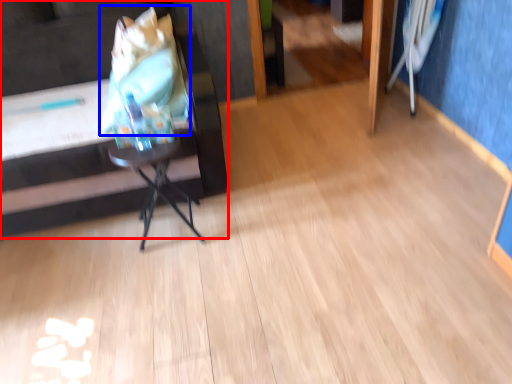
Question: Which object is further to the camera taking this photo, furniture (highlighted by a red box) or grocery bag (highlighted by a blue box)?

Choices:
 (A) furniture
 (B) grocery bag

Answer: (B)